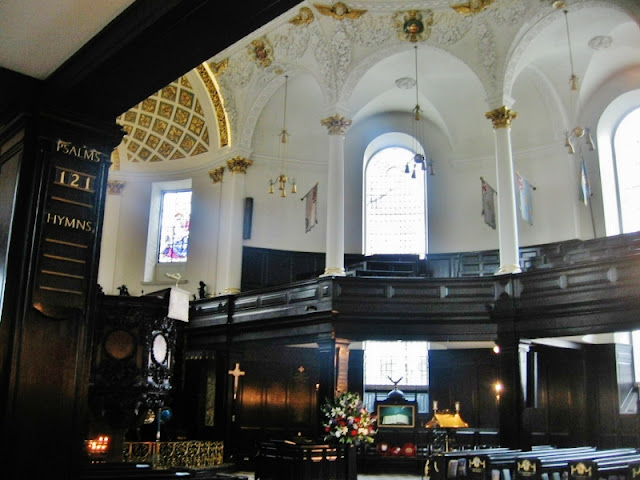
The image size is (640, 480). What are the coordinates of `candles` in the screenshot? It's located at (96, 446).